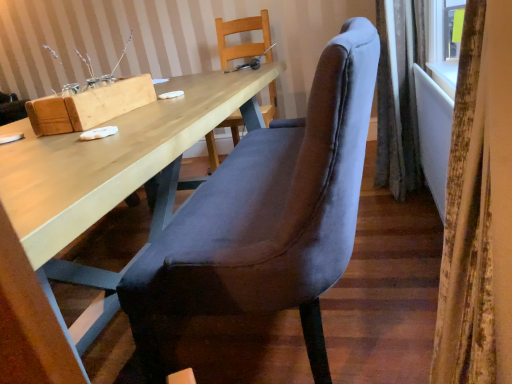
Question: Which direction should I rotate to look at wooden chair at upper center, acting as the 2th chair starting from the front, — up or down?

Choices:
 (A) up
 (B) down

Answer: (A)

Question: Should I look upward or downward to see velvet curtain at right, placed as the second curtain when sorted from right to left?

Choices:
 (A) down
 (B) up

Answer: (A)

Question: From a real-world perspective, is velvet grey chair at center, positioned as the 1th chair in front-to-back order, below wooden chair at upper center, marked as the first chair in a back-to-front arrangement?

Choices:
 (A) yes
 (B) no

Answer: (A)

Question: From the image's perspective, is velvet grey chair at center, the 2th chair positioned from the back, located above wooden chair at upper center, marked as the first chair in a back-to-front arrangement?

Choices:
 (A) no
 (B) yes

Answer: (A)

Question: Is velvet grey chair at center, positioned as the 1th chair in front-to-back order, not within wooden chair at upper center, marked as the first chair in a back-to-front arrangement?

Choices:
 (A) yes
 (B) no

Answer: (A)

Question: Is velvet grey chair at center, positioned as the 1th chair in front-to-back order, looking in the opposite direction of wooden chair at upper center, acting as the 2th chair starting from the front?

Choices:
 (A) yes
 (B) no

Answer: (B)

Question: Is velvet grey chair at center, positioned as the 1th chair in front-to-back order, far from wooden chair at upper center, acting as the 2th chair starting from the front?

Choices:
 (A) yes
 (B) no

Answer: (A)

Question: Would you say velvet grey chair at center, positioned as the 1th chair in front-to-back order, contains wooden chair at upper center, marked as the first chair in a back-to-front arrangement?

Choices:
 (A) no
 (B) yes

Answer: (A)

Question: Does matte wood desk at center come behind velvet grey chair at center, positioned as the 1th chair in front-to-back order?

Choices:
 (A) yes
 (B) no

Answer: (B)

Question: From the image's perspective, is matte wood desk at center over velvet grey chair at center, positioned as the 1th chair in front-to-back order?

Choices:
 (A) no
 (B) yes

Answer: (A)

Question: Can you confirm if matte wood desk at center is wider than velvet grey chair at center, positioned as the 1th chair in front-to-back order?

Choices:
 (A) no
 (B) yes

Answer: (B)

Question: Could you tell me if matte wood desk at center is turned towards velvet grey chair at center, the 2th chair positioned from the back?

Choices:
 (A) no
 (B) yes

Answer: (B)

Question: Can you confirm if matte wood desk at center is bigger than velvet grey chair at center, the 2th chair positioned from the back?

Choices:
 (A) no
 (B) yes

Answer: (B)

Question: Does matte wood desk at center contain velvet grey chair at center, positioned as the 1th chair in front-to-back order?

Choices:
 (A) yes
 (B) no

Answer: (B)

Question: Is matte wood desk at center taller than wooden chair at upper center, marked as the first chair in a back-to-front arrangement?

Choices:
 (A) yes
 (B) no

Answer: (B)